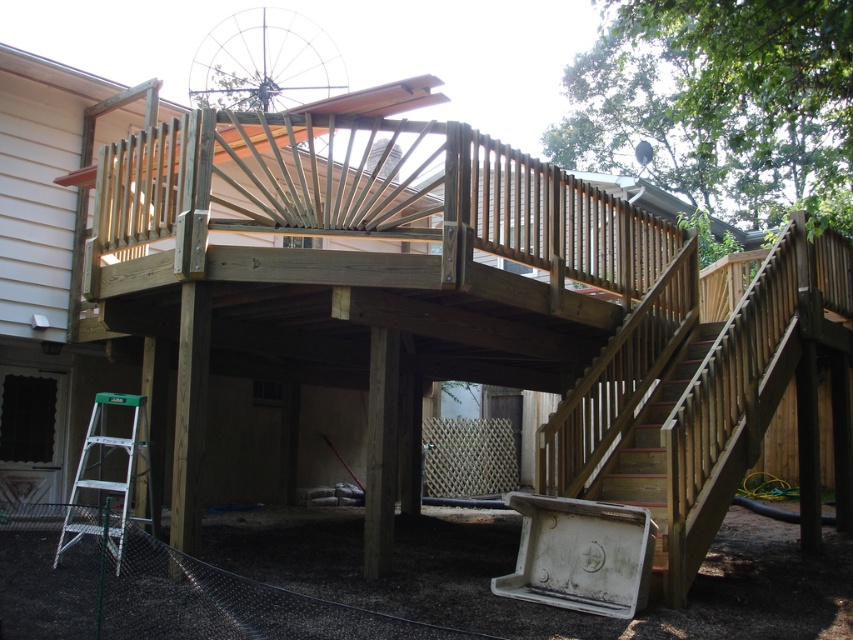
Question: Which point is closer to the camera taking this photo?

Choices:
 (A) pos(102,426)
 (B) pos(622,474)

Answer: (B)

Question: Can you confirm if silver/aluminum step ladder at lower left is bigger than wooden stairs at lower right?

Choices:
 (A) no
 (B) yes

Answer: (A)

Question: Among these objects, which one is farthest from the camera?

Choices:
 (A) wooden stairs at lower right
 (B) silver/aluminum step ladder at lower left

Answer: (A)

Question: Can you confirm if silver/aluminum step ladder at lower left is positioned to the right of wooden stairs at lower right?

Choices:
 (A) no
 (B) yes

Answer: (A)

Question: Is silver/aluminum step ladder at lower left to the right of wooden stairs at lower right from the viewer's perspective?

Choices:
 (A) yes
 (B) no

Answer: (B)